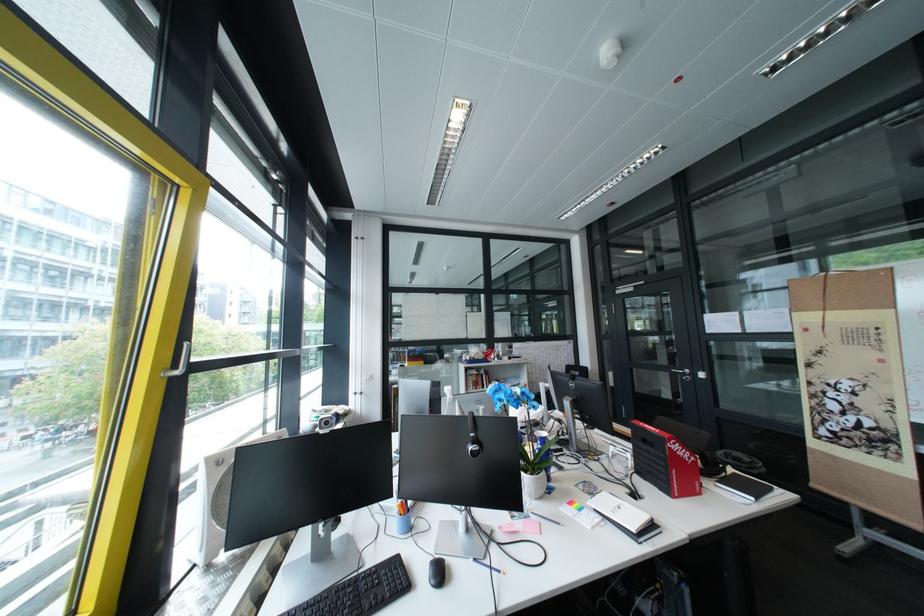
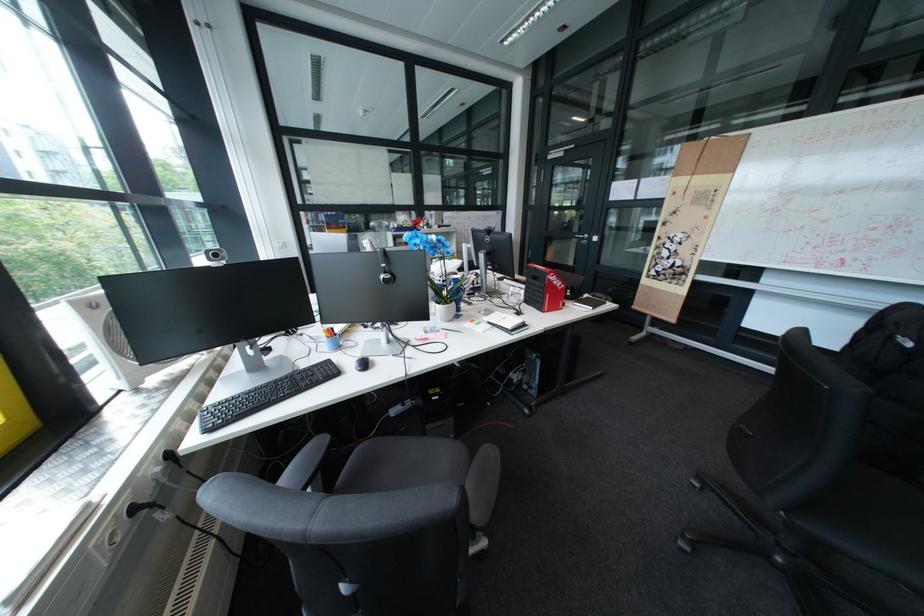
Locate, in the second image, the point that corresponds to (542,469) in the first image.

(456, 302)